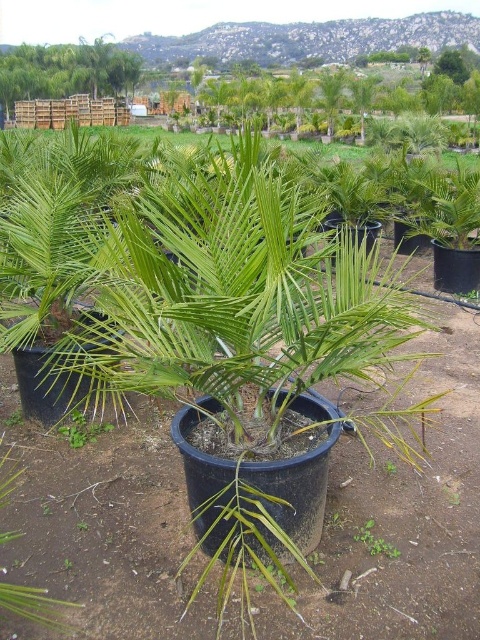
Does green matte palm tree at center appear on the right side of green leafy plant at upper left?

Yes, green matte palm tree at center is to the right of green leafy plant at upper left.

Is point (171, 376) positioned in front of point (29, 81)?

Yes, point (171, 376) is in front of point (29, 81).

The image size is (480, 640). I want to click on green matte palm tree at center, so click(229, 291).